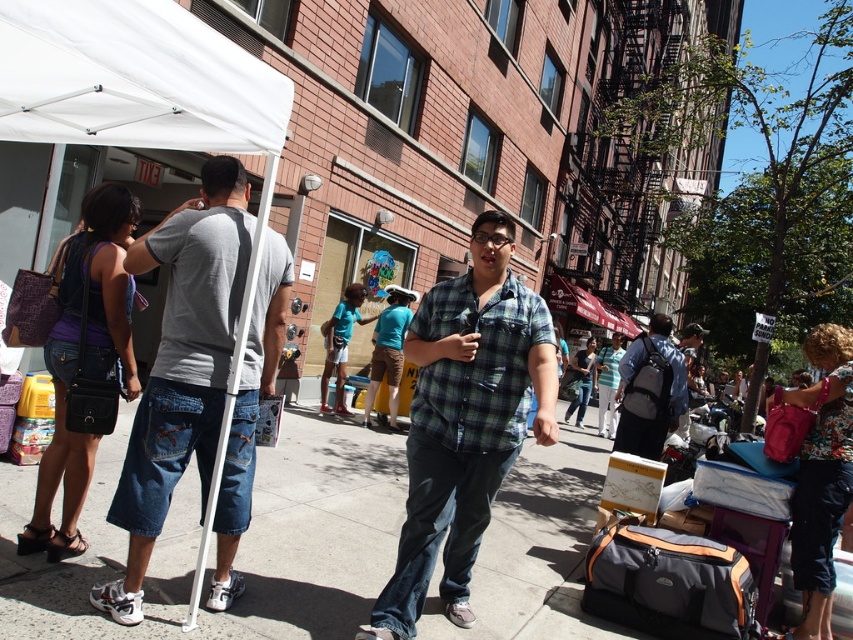
You are a photographer trying to capture a photo of both the denim shorts at left and the green plaid shirt at center. Since you want both subjects to appear equally prominent in the photo, which subject should you zoom in on more?

Since the denim shorts at left has a smaller size compared to green plaid shirt at center, you should zoom in more on the denim shorts at left to make it appear larger and balance its prominence with the green plaid shirt at center.

You are a photographer trying to capture a shot of the denim shorts at left and the white fabric canopy at upper left. Which object should you zoom in on to focus on the smaller one?

The denim shorts at left has a smaller size compared to the white fabric canopy at upper left, so you should zoom in on the denim shorts at left to focus on the smaller one.

You are standing at the point closer to the camera in this street scene. There are two points marked in the image, one at point (219, 275) and another at point (170, 100). Which point are you standing at?

You are standing at point (219, 275) because it is further to the camera than point (170, 100).